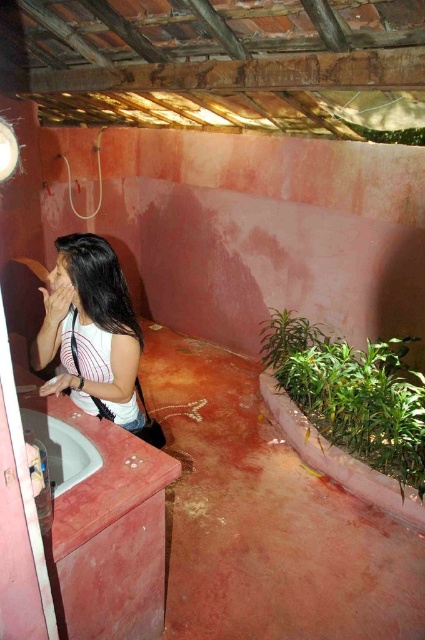
Question: Does white striped shirt at left appear on the left side of white glossy sink at lower left?

Choices:
 (A) no
 (B) yes

Answer: (A)

Question: Which of the following is the closest to the observer?

Choices:
 (A) white striped shirt at left
 (B) white glossy sink at lower left

Answer: (B)

Question: Does white striped shirt at left lie behind white glossy sink at lower left?

Choices:
 (A) no
 (B) yes

Answer: (B)

Question: Is the position of white striped shirt at left less distant than that of white glossy sink at lower left?

Choices:
 (A) no
 (B) yes

Answer: (A)